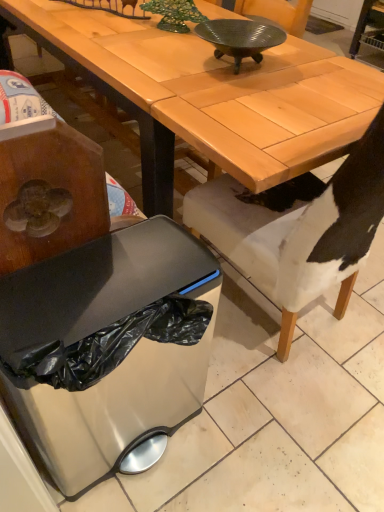
Where is `free space in front of metallic ribbed bowl at center`? This screenshot has height=512, width=384. free space in front of metallic ribbed bowl at center is located at coordinates (237, 98).